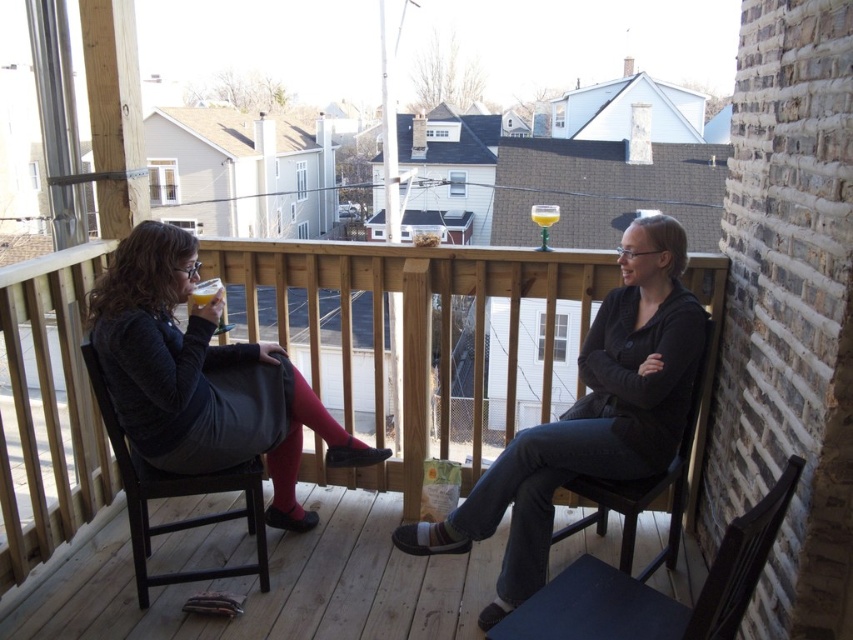
You are standing on the wooden deck at lower center and want to place a potted plant on the black wood chair at lower right. Based on their heights, will the potted plant be visible from your current position?

The wooden deck at lower center is not as tall as black wood chair at lower right, so the potted plant placed on the black wood chair at lower right will be higher up and thus visible from your position on the lower wooden deck at lower center.